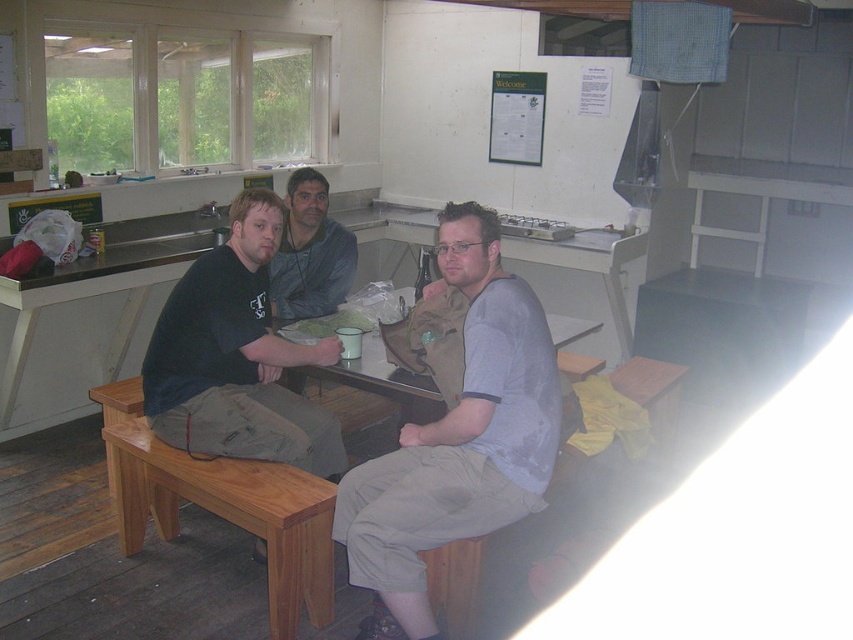
You are a person trying to sit down at the light brown wood bench at lower left and the matte gray jacket at center. Which one has a larger width?

The light brown wood bench at lower left has a larger width than the matte gray jacket at center.

You are a photographer standing in the room. You need to capture a photo of the gray cotton shirt at center and the light brown wood bench at lower left. Which object should be placed closer to the camera to ensure both are fully visible in the frame?

The gray cotton shirt at center is taller than the light brown wood bench at lower left. To ensure both are fully visible in the frame, the taller object, the gray cotton shirt at center, should be placed closer to the camera.